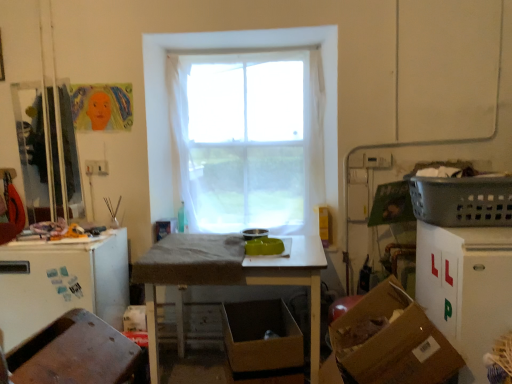
Question: Considering the positions of brown cardboard box at lower center, marked as the first cardboard box in a back-to-front arrangement, and gray plastic laundry basket at right in the image, is brown cardboard box at lower center, marked as the first cardboard box in a back-to-front arrangement, bigger or smaller than gray plastic laundry basket at right?

Choices:
 (A) small
 (B) big

Answer: (B)

Question: From a real-world perspective, is brown cardboard box at lower center, arranged as the 2th cardboard box when viewed from the front, physically located above or below gray plastic laundry basket at right?

Choices:
 (A) above
 (B) below

Answer: (B)

Question: Considering the real-world distances, which object is closest to the wooden chair at lower left?

Choices:
 (A) brown cardboard box at lower center, marked as the first cardboard box in a back-to-front arrangement
 (B) gray plastic laundry basket at right
 (C) brown cardboard box at lower right, acting as the 1th cardboard box starting from the front
 (D) wooden table at center
 (E) white matte refrigerator at left

Answer: (D)

Question: Which object is the farthest from the translucent fabric window at center?

Choices:
 (A) brown cardboard box at lower center, marked as the first cardboard box in a back-to-front arrangement
 (B) gray plastic laundry basket at right
 (C) wooden chair at lower left
 (D) brown cardboard box at lower right, which is the second cardboard box in back-to-front order
 (E) white matte refrigerator at left

Answer: (C)